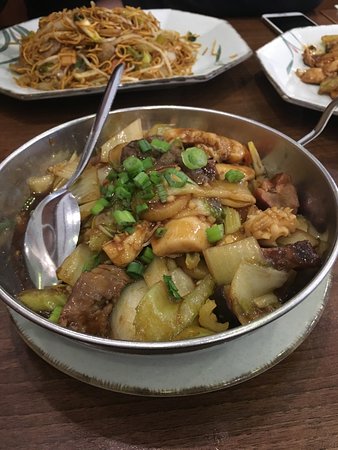
This screenshot has height=450, width=338. In order to click on table top in this screenshot , I will do `click(68, 429)`.